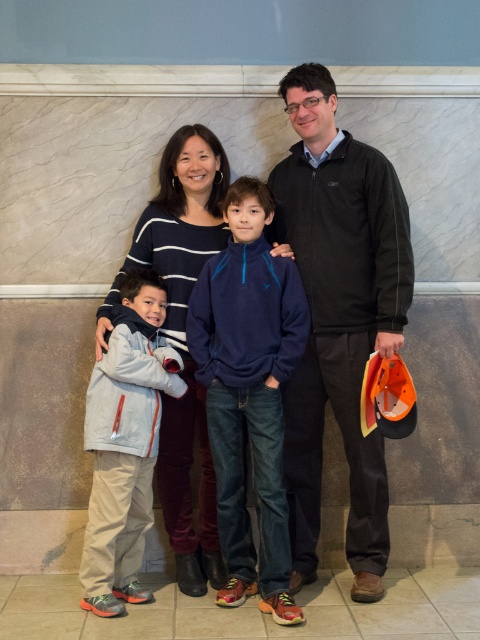
Who is positioned more to the right, striped sweater at center or light gray fleece jacket at left?

From the viewer's perspective, striped sweater at center appears more on the right side.

Consider the image. Can you confirm if striped sweater at center is positioned to the right of light gray fleece jacket at left?

Correct, you'll find striped sweater at center to the right of light gray fleece jacket at left.

Who is more forward, (168, 516) or (118, 374)?

Point (118, 374) is more forward.

Find the location of a particular element. The height and width of the screenshot is (640, 480). striped sweater at center is located at coordinates (182, 337).

Does point (384, 272) lie in front of point (105, 484)?

No, (384, 272) is behind (105, 484).

The height and width of the screenshot is (640, 480). What do you see at coordinates (338, 317) in the screenshot? I see `matte blue sweatshirt at center` at bounding box center [338, 317].

Between point (280, 186) and point (123, 352), which one is positioned in front?

Point (123, 352) is in front.

Find the location of a particular element. The height and width of the screenshot is (640, 480). matte blue sweatshirt at center is located at coordinates (338, 317).

Describe the element at coordinates (338, 316) in the screenshot. I see `dark gray fleece sweater at center` at that location.

Does dark gray fleece sweater at center have a greater width compared to light gray fleece jacket at left?

Indeed, dark gray fleece sweater at center has a greater width compared to light gray fleece jacket at left.

Is point (292, 550) positioned in front of point (156, 362)?

No, it is not.

Locate an element on the screen. The width and height of the screenshot is (480, 640). dark gray fleece sweater at center is located at coordinates (338, 316).